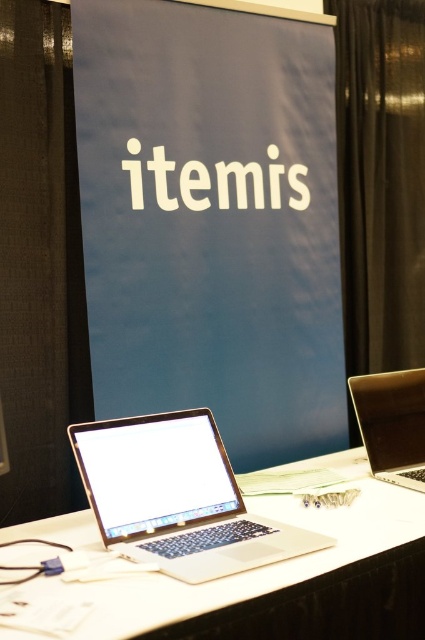
In the scene shown: You are setting up a booth for a tech conference. You have a blue matte signboard at center and a satin silver laptop at center. Which object would you need to place first if you want to ensure there is enough space for both on the table?

The blue matte signboard at center is larger in size than the satin silver laptop at center, so you should place the blue matte signboard at center first to ensure there is enough space for both on the table.

You are standing in front of the conference booth and need to place a small object on the table. There are two points marked on the table surface. One is at coordinates point (x=268, y=180) and the other is at point (x=396, y=445). Which point is closer to you, the viewer?

Point (x=268, y=180) is closer to you because it is further to the viewer than point (x=396, y=445).